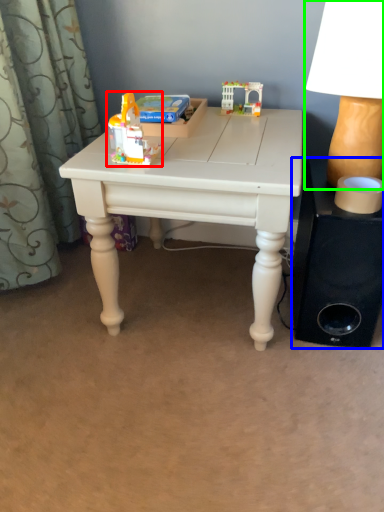
Question: Estimate the real-world distances between objects in this image. Which object is farther from toy (highlighted by a red box), speaker (highlighted by a blue box) or table lamp (highlighted by a green box)?

Choices:
 (A) speaker
 (B) table lamp

Answer: (A)